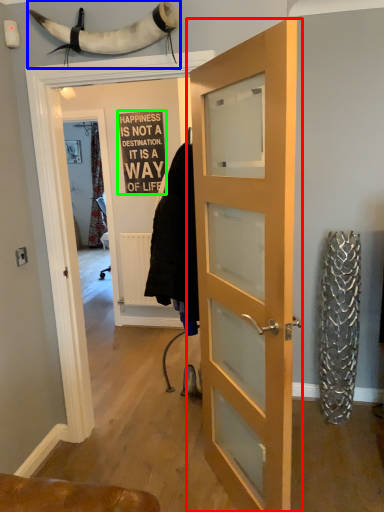
Question: Which object is positioned farthest from door (highlighted by a red box)? Select from animal (highlighted by a blue box) and writing (highlighted by a green box).

Choices:
 (A) animal
 (B) writing

Answer: (B)